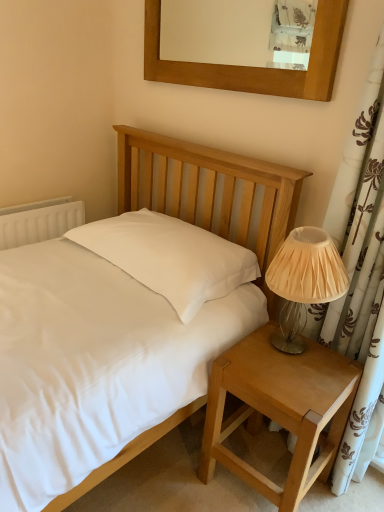
Find the location of a particular element. The image size is (384, 512). vacant space underneath ivory pleated fabric lampshade at right (from a real-world perspective) is located at coordinates (291, 345).